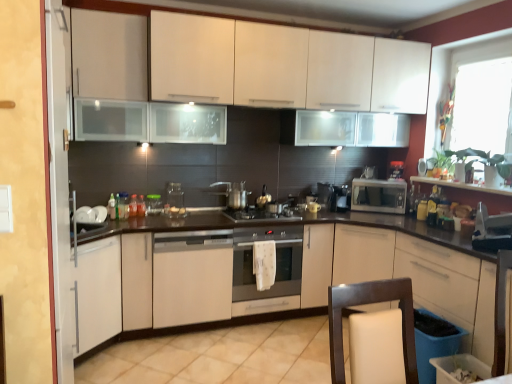
Question: From a real-world perspective, is white glossy cabinet at left on top of white matte cabinet at left, which is the 2th cabinetry in bottom-to-top order?

Choices:
 (A) yes
 (B) no

Answer: (A)

Question: Is white glossy cabinet at left taller than white matte cabinet at left, which is counted as the 2th cabinetry, starting from the top?

Choices:
 (A) no
 (B) yes

Answer: (B)

Question: Is white glossy cabinet at left oriented towards white matte cabinet at left, which is counted as the 2th cabinetry, starting from the top?

Choices:
 (A) yes
 (B) no

Answer: (B)

Question: Is white matte cabinet at left, which is counted as the 2th cabinetry, starting from the top, inside white glossy cabinet at left?

Choices:
 (A) no
 (B) yes

Answer: (A)

Question: Can you confirm if white glossy cabinet at left is positioned to the left of white matte cabinet at left, which is the 2th cabinetry in bottom-to-top order?

Choices:
 (A) yes
 (B) no

Answer: (B)

Question: Is white matte dishwasher at center, the 2th home appliance viewed from the right, taller or shorter than black stainless steel gas stove at center?

Choices:
 (A) tall
 (B) short

Answer: (A)

Question: Is white matte dishwasher at center, the 2th home appliance viewed from the right, to the left or to the right of black stainless steel gas stove at center in the image?

Choices:
 (A) left
 (B) right

Answer: (A)

Question: From a real-world perspective, is white matte dishwasher at center, the 2th home appliance viewed from the right, above or below black stainless steel gas stove at center?

Choices:
 (A) below
 (B) above

Answer: (A)

Question: In terms of width, does white matte dishwasher at center, the 2th home appliance viewed from the right, look wider or thinner when compared to black stainless steel gas stove at center?

Choices:
 (A) thin
 (B) wide

Answer: (B)

Question: From a real-world perspective, is black stainless steel gas stove at center physically located above or below white matte dishwasher at center, the 2th home appliance viewed from the right?

Choices:
 (A) above
 (B) below

Answer: (A)

Question: In terms of width, does black stainless steel gas stove at center look wider or thinner when compared to white matte dishwasher at center, the 2th home appliance viewed from the right?

Choices:
 (A) wide
 (B) thin

Answer: (B)

Question: From the image's perspective, is black stainless steel gas stove at center positioned above or below white matte dishwasher at center, positioned as the 1th home appliance in left-to-right order?

Choices:
 (A) above
 (B) below

Answer: (A)

Question: Considering the positions of point (237, 221) and point (228, 317), is point (237, 221) closer or farther from the camera than point (228, 317)?

Choices:
 (A) closer
 (B) farther

Answer: (A)

Question: Would you say transparent glass jar at center, which is counted as the eighth appliance, starting from the right, is inside or outside translucent glass jar at center, which is counted as the 1th bottle, starting from the left?

Choices:
 (A) inside
 (B) outside

Answer: (B)

Question: From a real-world perspective, is transparent glass jar at center, which is counted as the eighth appliance, starting from the right, physically located above or below translucent glass jar at center, which is counted as the 1th bottle, starting from the left?

Choices:
 (A) below
 (B) above

Answer: (B)